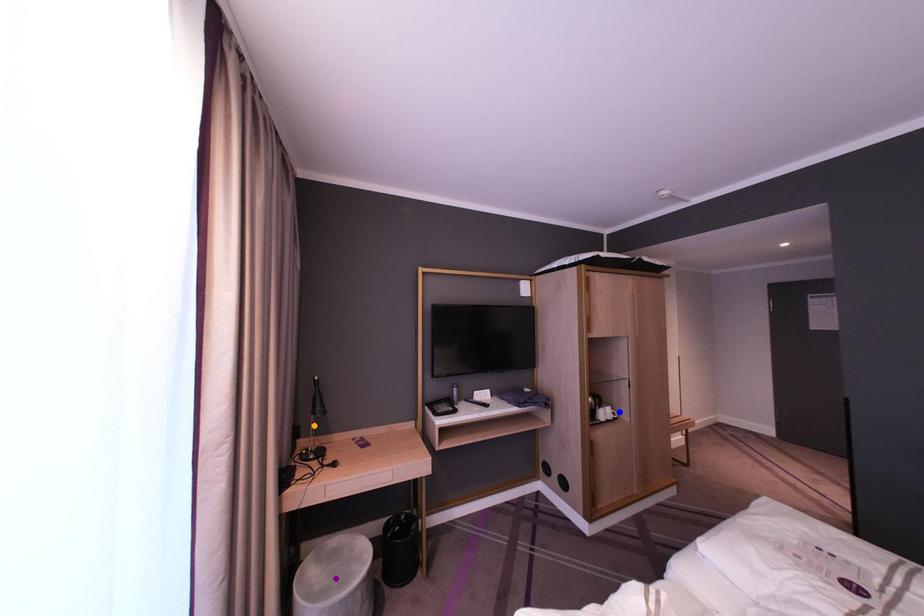
Order these from nearest to farthest:
blue point, orange point, purple point

1. purple point
2. orange point
3. blue point